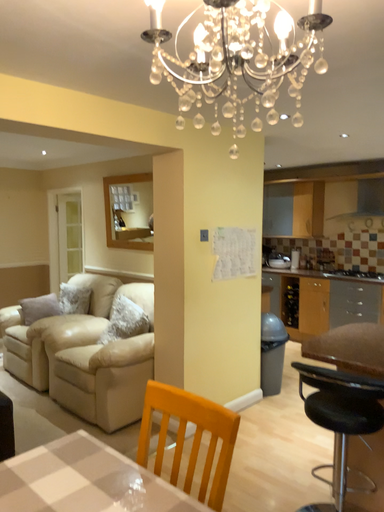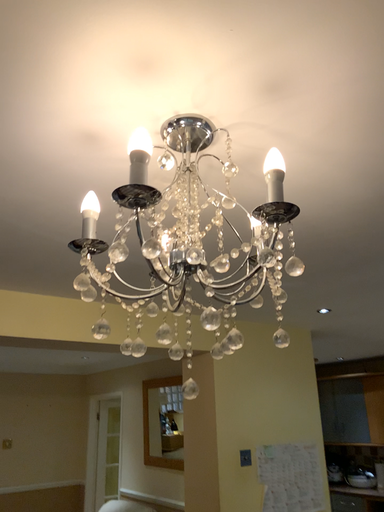
Question: Which way did the camera rotate in the video?

Choices:
 (A) rotated right
 (B) rotated left

Answer: (B)